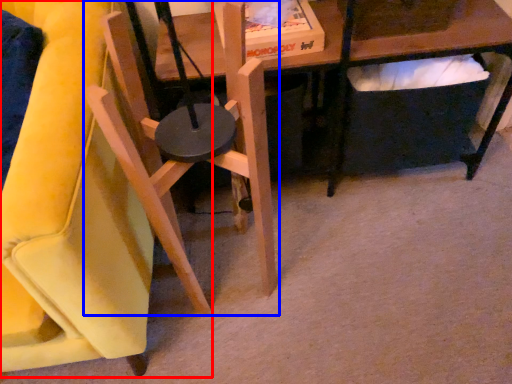
Question: Which point is closer to the camera, chair (highlighted by a red box) or chair (highlighted by a blue box)?

Choices:
 (A) chair
 (B) chair

Answer: (A)